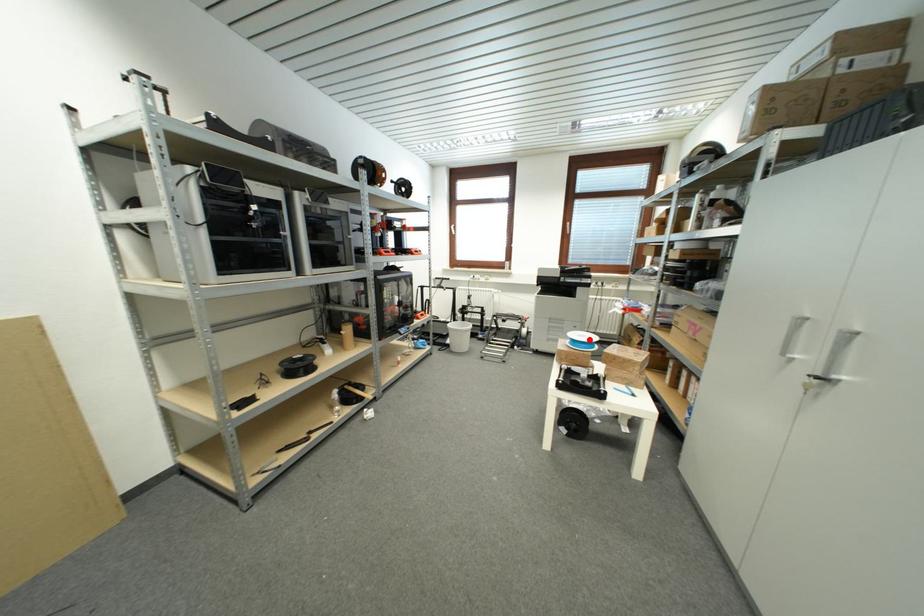
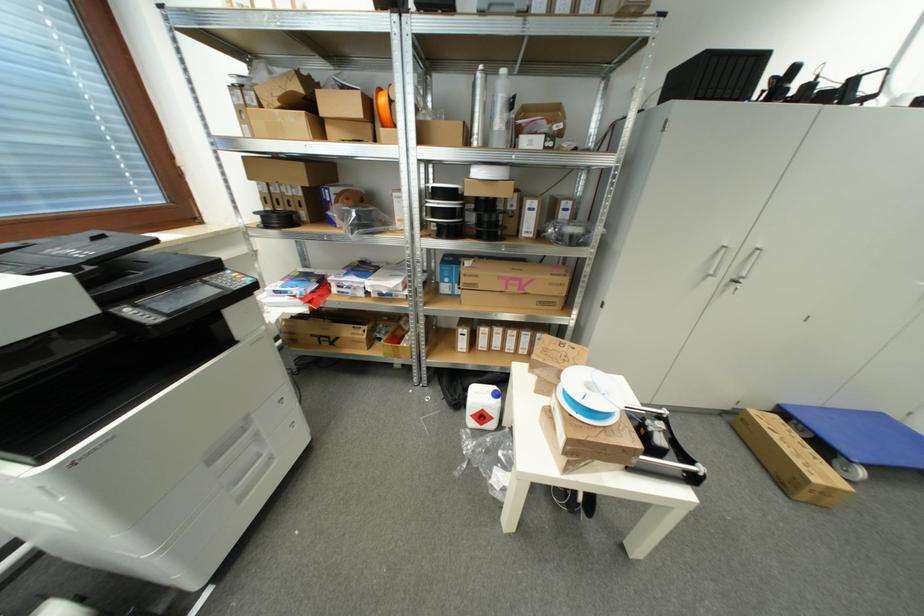
Where in the second image is the point corresponding to the highlighted location from the first image?

(594, 387)